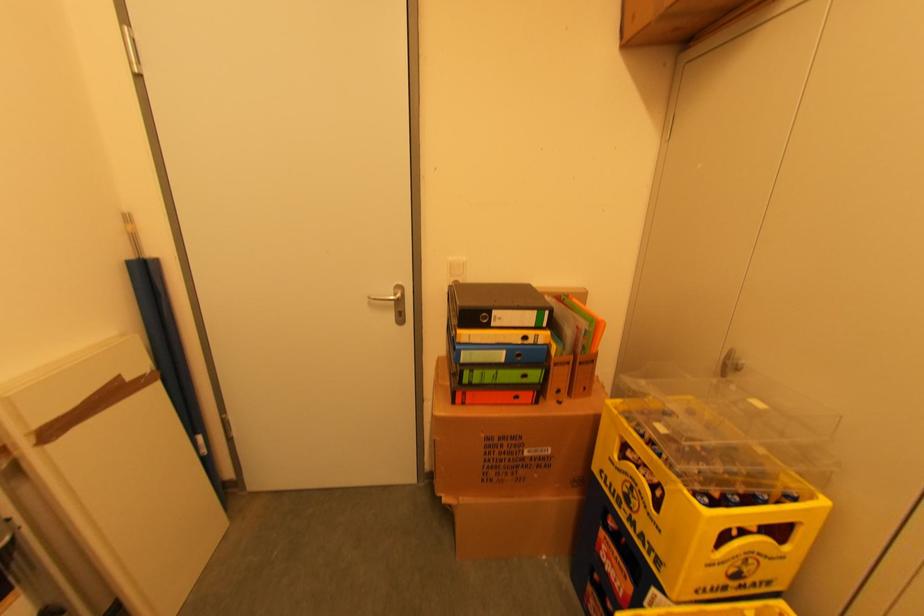
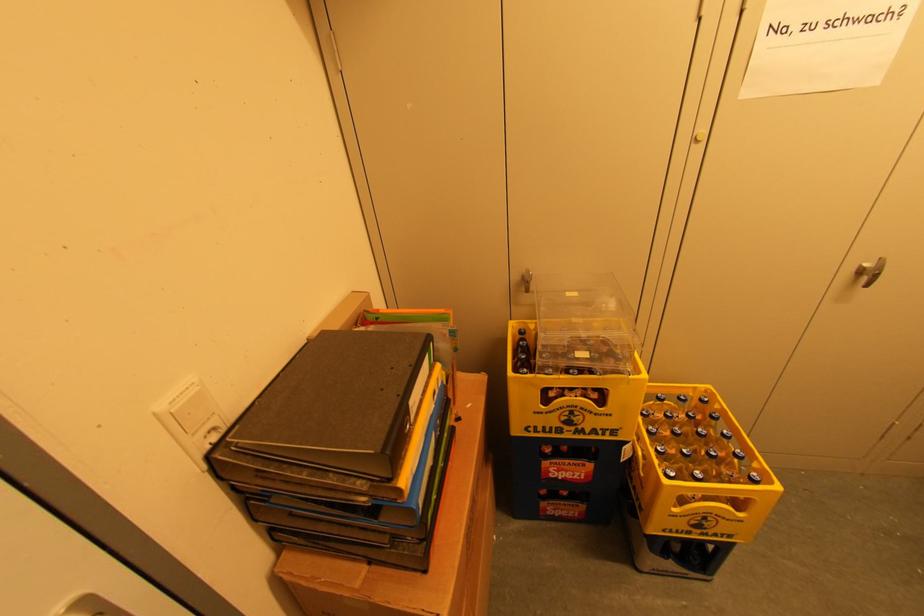
Find the pixel in the second image that matches pixel 533 341 in the first image.

(440, 392)